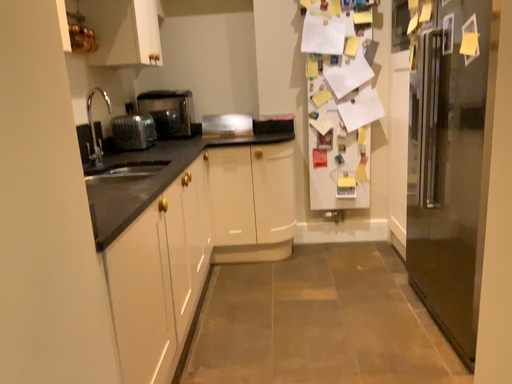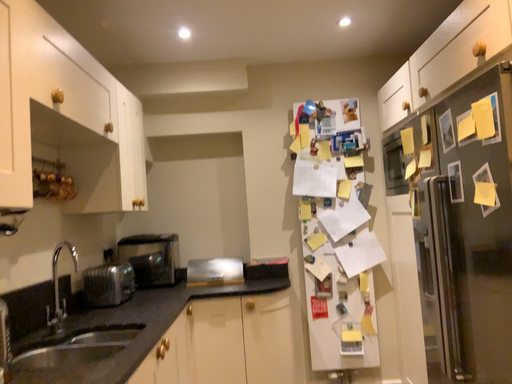
Question: How did the camera likely rotate when shooting the video?

Choices:
 (A) rotated upward
 (B) rotated downward

Answer: (A)